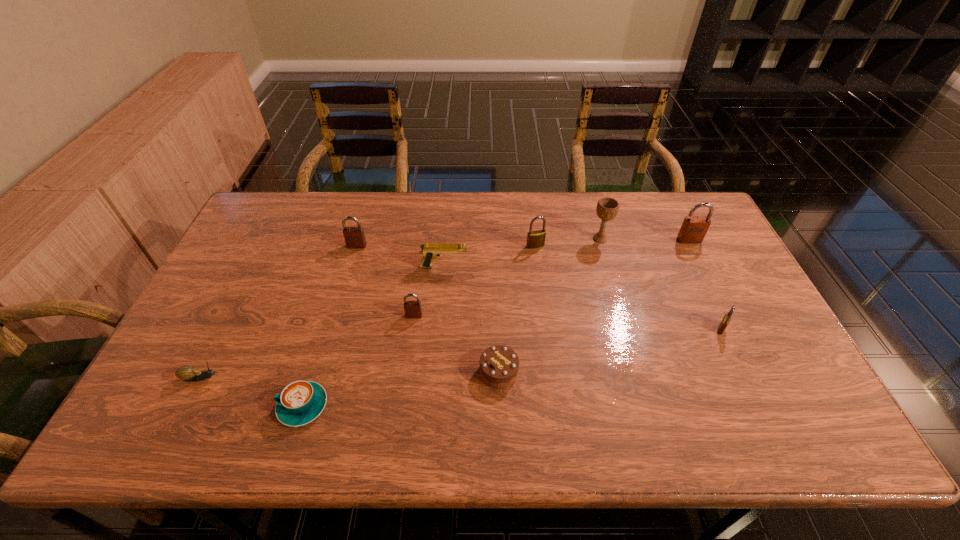
The height and width of the screenshot is (540, 960). Identify the location of blank region between the left brass padlock and the fourth padlock from right to left. (474, 281).

Where is `blank region between the smallest brown padlock and the eighth object from left to right`? blank region between the smallest brown padlock and the eighth object from left to right is located at coordinates (507, 277).

You are a GUI agent. You are given a task and a screenshot of the screen. Output one action in this format:
    pyautogui.click(x=<x>, y=<y>)
    Task: Click on the free space between the rightmost brown padlock and the brown chocolate cake
    The image size is (960, 540).
    Given the screenshot: What is the action you would take?
    [x=594, y=306]

Find the location of `empty location between the nearest padlock and the beige chalice`. empty location between the nearest padlock and the beige chalice is located at coordinates (660, 284).

What are the coordinates of `vacant point located between the cappuccino and the brown chocolate cake` in the screenshot? It's located at (401, 389).

The height and width of the screenshot is (540, 960). Identify the location of vacant space that is in between the bigger brass padlock and the biggest brown padlock. (612, 243).

You are a GUI agent. You are given a task and a screenshot of the screen. Output one action in this format:
    pyautogui.click(x=<x>, y=<y>)
    Task: Click on the vacant area between the tallest padlock and the smallest brown padlock
    
    Given the screenshot: What is the action you would take?
    pyautogui.click(x=552, y=278)

Choose which object is the sixth nearest neighbor to the escargot. Please provide its 2D coordinates. Your answer should be formatted as a tuple, i.e. [(x, y)], where the tuple contains the x and y coordinates of a point satisfying the conditions above.

[(535, 239)]

Where is `the closest object to the sixth farthest object`? The height and width of the screenshot is (540, 960). the closest object to the sixth farthest object is located at coordinates 430,251.

This screenshot has height=540, width=960. Find the location of `padlock that stands as the third closest to the nearer brass padlock`. padlock that stands as the third closest to the nearer brass padlock is located at coordinates (413, 309).